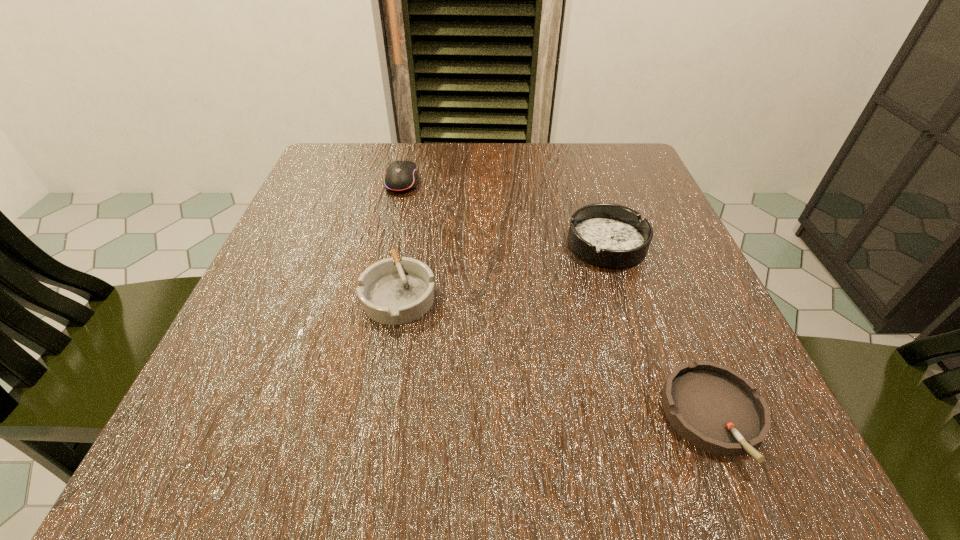
You are a GUI agent. You are given a task and a screenshot of the screen. Output one action in this format:
    pyautogui.click(x=<x>, y=<y>)
    Task: Click on the computer mouse
    This screenshot has width=960, height=540.
    Given the screenshot: What is the action you would take?
    pyautogui.click(x=400, y=176)

Locate an element on the screen. This screenshot has height=540, width=960. the leftmost ashtray is located at coordinates (391, 292).

Identify the location of the nearest ashtray. The height and width of the screenshot is (540, 960). (718, 410).

Locate an element on the screen. The height and width of the screenshot is (540, 960). free spot located 0.140m on the right of the farthest object is located at coordinates (484, 181).

Locate an element on the screen. The height and width of the screenshot is (540, 960). free space located 0.160m on the right of the leftmost ashtray is located at coordinates (537, 294).

At what (x,y) coordinates should I click in order to perform the action: click on vacant region located on the left of the nearest ashtray. Please return your answer as a coordinate pair (x, y). The height and width of the screenshot is (540, 960). Looking at the image, I should click on (475, 417).

Image resolution: width=960 pixels, height=540 pixels. In order to click on object at the far edge in this screenshot , I will do `click(400, 176)`.

Where is `object situated at the near edge`? The height and width of the screenshot is (540, 960). object situated at the near edge is located at coordinates (718, 410).

This screenshot has height=540, width=960. Find the location of `object present at the left edge`. object present at the left edge is located at coordinates point(400,176).

I want to click on object present at the far left corner, so pyautogui.click(x=400, y=176).